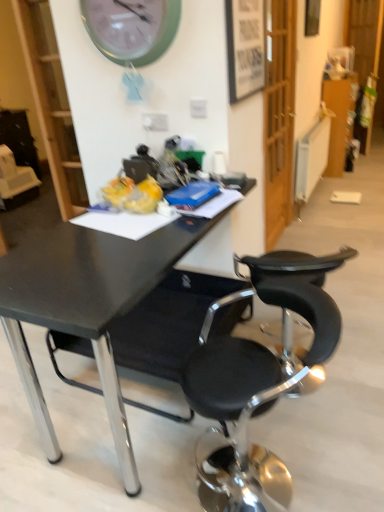
Question: Is wooden framed poster at upper center, which is counted as the 1th picture frame, starting from the front, aimed at white glossy bookshelf at upper left?

Choices:
 (A) yes
 (B) no

Answer: (B)

Question: From a real-world perspective, is wooden framed poster at upper center, which is counted as the 2th picture frame, starting from the back, physically below white glossy bookshelf at upper left?

Choices:
 (A) yes
 (B) no

Answer: (B)

Question: Considering the relative sizes of wooden framed poster at upper center, which is counted as the 2th picture frame, starting from the back, and white glossy bookshelf at upper left in the image provided, is wooden framed poster at upper center, which is counted as the 2th picture frame, starting from the back, bigger than white glossy bookshelf at upper left?

Choices:
 (A) yes
 (B) no

Answer: (B)

Question: Does wooden framed poster at upper center, which is counted as the 2th picture frame, starting from the back, have a smaller size compared to white glossy bookshelf at upper left?

Choices:
 (A) yes
 (B) no

Answer: (A)

Question: Is wooden framed poster at upper center, which is the 1th picture frame from left to right, at the right side of white glossy bookshelf at upper left?

Choices:
 (A) no
 (B) yes

Answer: (B)

Question: Visually, is wooden picture frame at upper right, marked as the 2th picture frame in a left-to-right arrangement, positioned to the left or to the right of green plastic wall clock at upper center?

Choices:
 (A) left
 (B) right

Answer: (B)

Question: Is wooden picture frame at upper right, acting as the 1th picture frame starting from the right, inside the boundaries of green plastic wall clock at upper center, or outside?

Choices:
 (A) inside
 (B) outside

Answer: (B)

Question: Considering their positions, is wooden picture frame at upper right, the 2th picture frame when ordered from bottom to top, located in front of or behind green plastic wall clock at upper center?

Choices:
 (A) front
 (B) behind

Answer: (B)

Question: Looking at their shapes, would you say wooden picture frame at upper right, marked as the 2th picture frame in a left-to-right arrangement, is wider or thinner than green plastic wall clock at upper center?

Choices:
 (A) thin
 (B) wide

Answer: (A)

Question: Is wooden framed poster at upper center, which is counted as the 1th picture frame, starting from the front, bigger or smaller than white glossy bookshelf at upper left?

Choices:
 (A) small
 (B) big

Answer: (A)

Question: Considering the relative positions of wooden framed poster at upper center, the second picture frame in the right-to-left sequence, and white glossy bookshelf at upper left in the image provided, is wooden framed poster at upper center, the second picture frame in the right-to-left sequence, to the left or to the right of white glossy bookshelf at upper left?

Choices:
 (A) left
 (B) right

Answer: (B)

Question: Is point (261, 41) closer or farther from the camera than point (39, 125)?

Choices:
 (A) closer
 (B) farther

Answer: (A)

Question: From their relative heights in the image, would you say wooden framed poster at upper center, the second picture frame in the right-to-left sequence, is taller or shorter than white glossy bookshelf at upper left?

Choices:
 (A) tall
 (B) short

Answer: (B)

Question: Looking at their shapes, would you say black matte desk at center is wider or thinner than wooden picture frame at upper right, the 1th picture frame positioned from the top?

Choices:
 (A) wide
 (B) thin

Answer: (A)

Question: Is black matte desk at center inside or outside of wooden picture frame at upper right, arranged as the 2th picture frame when viewed from the front?

Choices:
 (A) inside
 (B) outside

Answer: (B)